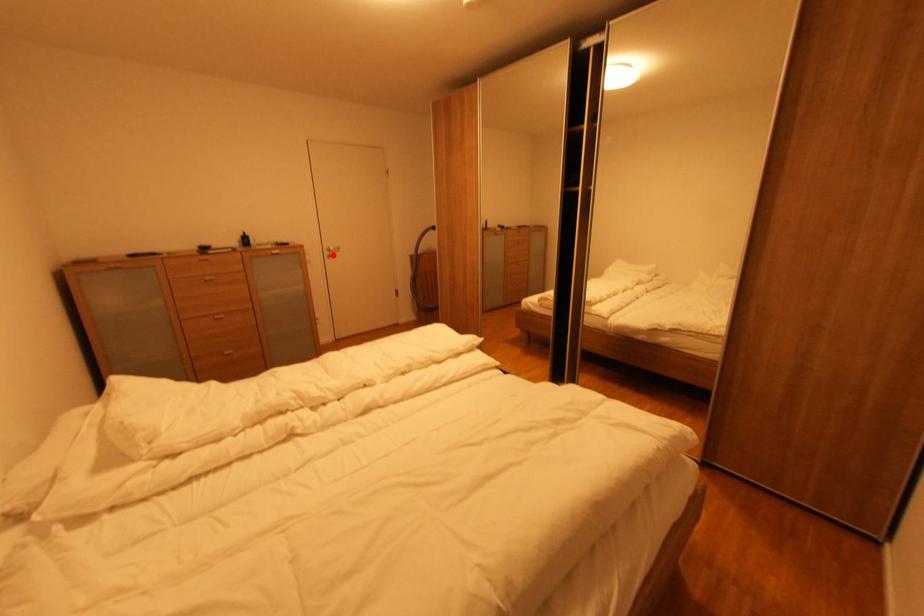
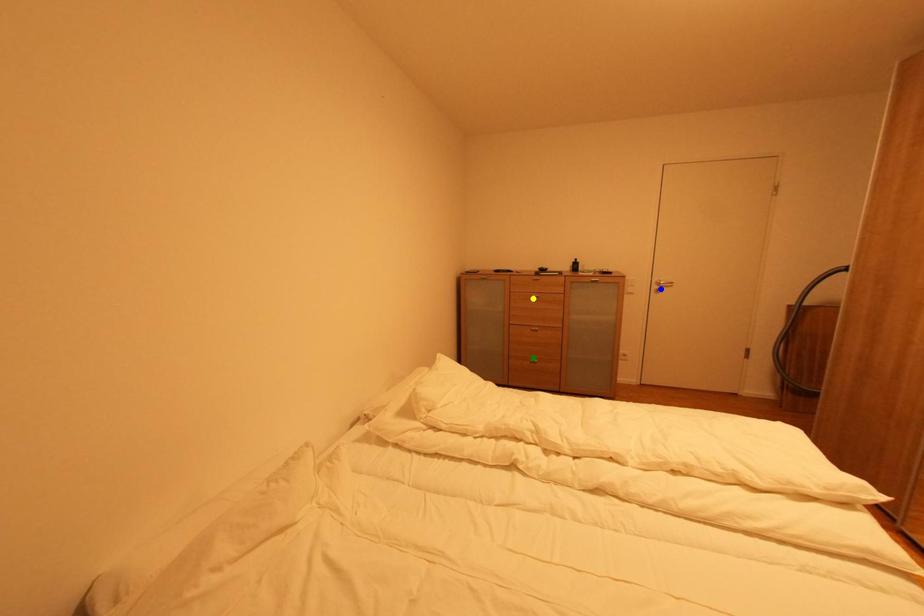
Question: I am providing you with two images of the same scene from different viewpoints. A red point is marked on the first image. You are given multiple points on the second image. Which point in image 2 is actually the same real-world point as the red point in image 1?

Choices:
 (A) yellow point
 (B) green point
 (C) blue point

Answer: (C)